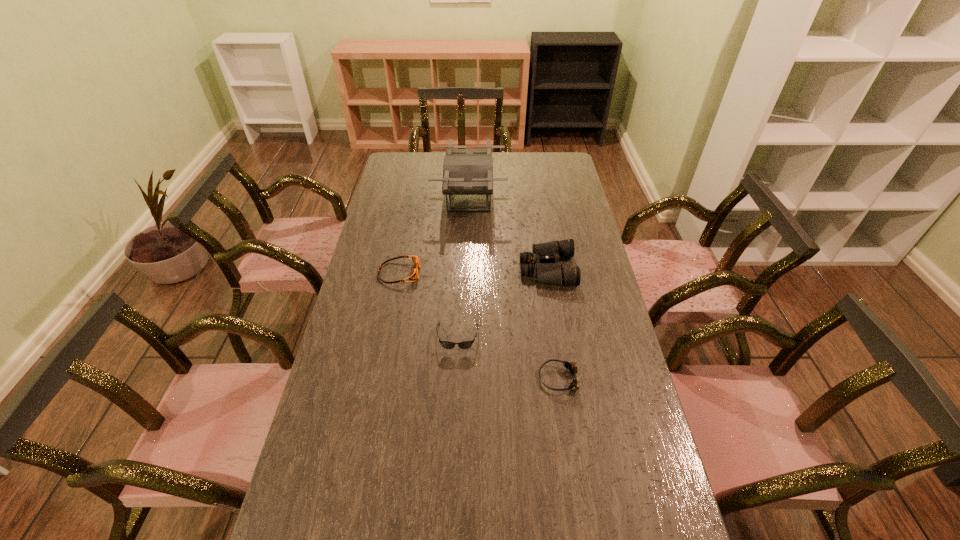
Find the location of `the farthest object`. the farthest object is located at coordinates click(465, 171).

At what (x,y) coordinates should I click in order to perform the action: click on drone. Please return your answer as a coordinate pair (x, y). This screenshot has width=960, height=540. Looking at the image, I should click on (465, 171).

You are a GUI agent. You are given a task and a screenshot of the screen. Output one action in this format:
    pyautogui.click(x=<x>, y=<y>)
    Task: Click on the binoculars
    The height and width of the screenshot is (540, 960).
    Given the screenshot: What is the action you would take?
    pyautogui.click(x=550, y=273)

The image size is (960, 540). Find the location of `sunglasses`. sunglasses is located at coordinates (445, 344).

Where is `the left goggles`? The image size is (960, 540). the left goggles is located at coordinates (414, 274).

Where is `the farther goggles`? The width and height of the screenshot is (960, 540). the farther goggles is located at coordinates (414, 274).

The width and height of the screenshot is (960, 540). In order to click on the nearest object in this screenshot , I will do `click(570, 366)`.

Find the location of a particular element. the nearer goggles is located at coordinates (570, 366).

You are a GUI agent. You are given a task and a screenshot of the screen. Output one action in this format:
    pyautogui.click(x=<x>, y=<y>)
    Task: Click on the free space located with a camera mounted on the underside of the drone
    The height and width of the screenshot is (540, 960).
    Given the screenshot: What is the action you would take?
    pyautogui.click(x=580, y=197)

Find the location of `vacant space situated 0.260m through the eyepieces of the binoculars`. vacant space situated 0.260m through the eyepieces of the binoculars is located at coordinates (450, 269).